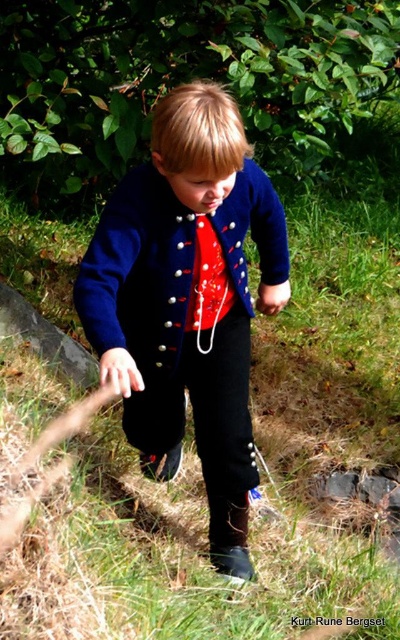
You are a tailor who needs to adjust the navy wool jacket at center and the shiny red fabric tie at center. Which item requires more space on the worktable due to its size?

The navy wool jacket at center requires more space on the worktable because its width is larger than the shiny red fabric tie at center.